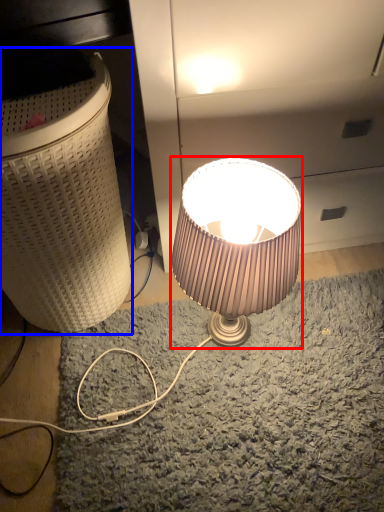
Question: Which point is closer to the camera, lamp (highlighted by a red box) or laundry basket (highlighted by a blue box)?

Choices:
 (A) lamp
 (B) laundry basket

Answer: (B)